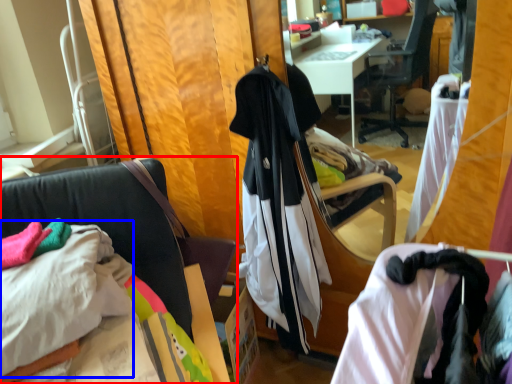
Question: Which point is further to the camera, chair (highlighted by a red box) or sheet (highlighted by a blue box)?

Choices:
 (A) chair
 (B) sheet

Answer: (B)